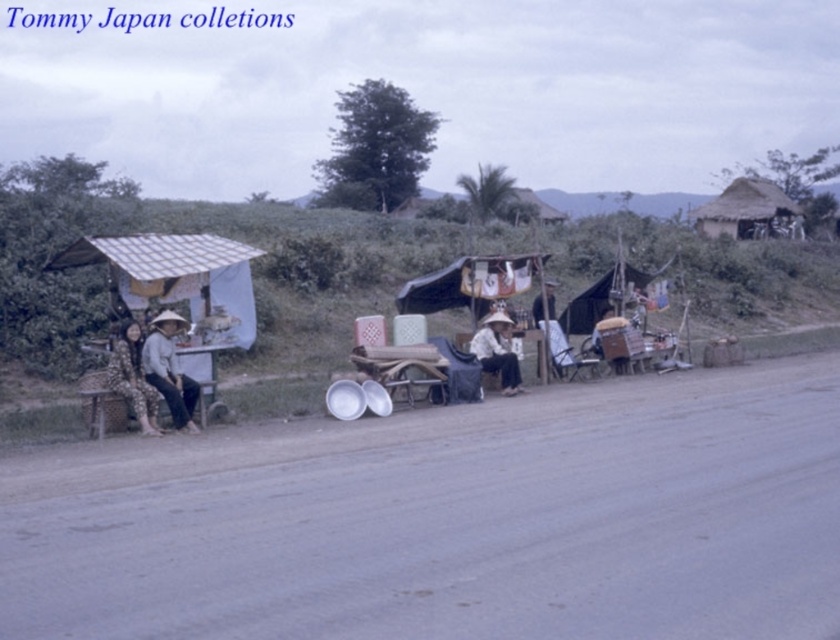
Does point (165, 378) come closer to viewer compared to point (646, 282)?

Yes, it is.

Is matte white hat at left above black fabric canopy at center?

Actually, matte white hat at left is below black fabric canopy at center.

Between point (176, 320) and point (600, 304), which one is positioned in front?

Positioned in front is point (176, 320).

You are a GUI agent. You are given a task and a screenshot of the screen. Output one action in this format:
    pyautogui.click(x=<x>, y=<y>)
    Task: Click on the matte white hat at left
    Image resolution: width=840 pixels, height=640 pixels.
    Given the screenshot: What is the action you would take?
    pyautogui.click(x=169, y=369)

Is camouflage fabric pants at left below matte white hat at center?

Correct, camouflage fabric pants at left is located below matte white hat at center.

Is point (151, 412) closer to camera compared to point (507, 353)?

Yes, point (151, 412) is closer to viewer.

Measure the distance between camouflage fabric pants at left and camera.

They are 47.62 feet apart.

This screenshot has width=840, height=640. In order to click on camouflage fabric pants at left in this screenshot , I will do `click(132, 378)`.

Can you confirm if white fabric canopy at center is taller than camouflage fabric pants at left?

No.

Locate an element on the screen. This screenshot has height=640, width=840. white fabric canopy at center is located at coordinates tap(470, 284).

Locate an element on the screen. The image size is (840, 640). white fabric canopy at center is located at coordinates (470, 284).